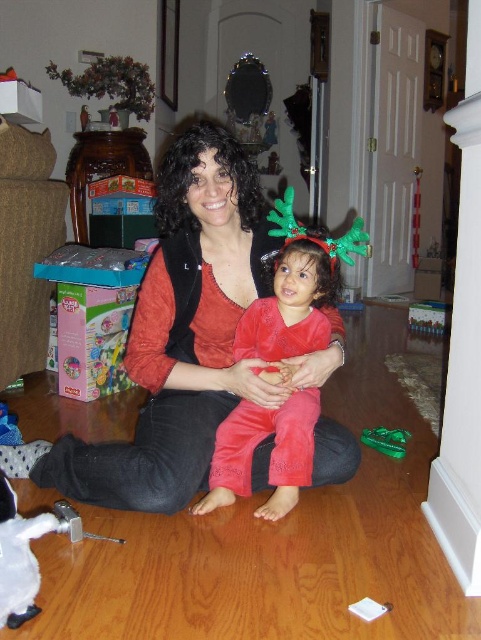
Between matte black vest at center and green plastic toy at lower right, which one has more height?

matte black vest at center

Is point (228, 285) in front of point (402, 442)?

Yes, it is.

Locate an element on the screen. This screenshot has height=640, width=481. matte black vest at center is located at coordinates (177, 337).

Does velvet red pants at center appear on the right side of green plastic toy at lower right?

In fact, velvet red pants at center is to the left of green plastic toy at lower right.

Which is in front, point (280, 497) or point (390, 444)?

Point (280, 497) is more forward.

Locate an element on the screen. This screenshot has height=640, width=481. velvet red pants at center is located at coordinates (270, 452).

Which of these two, matte black vest at center or velvet red pants at center, stands taller?

matte black vest at center is taller.

Does matte black vest at center have a lesser height compared to velvet red pants at center?

No, matte black vest at center is not shorter than velvet red pants at center.

Who is more distant from viewer, [189,403] or [286,344]?

The point [189,403] is more distant.

Identify the location of matte black vest at center. The image size is (481, 640). (177, 337).